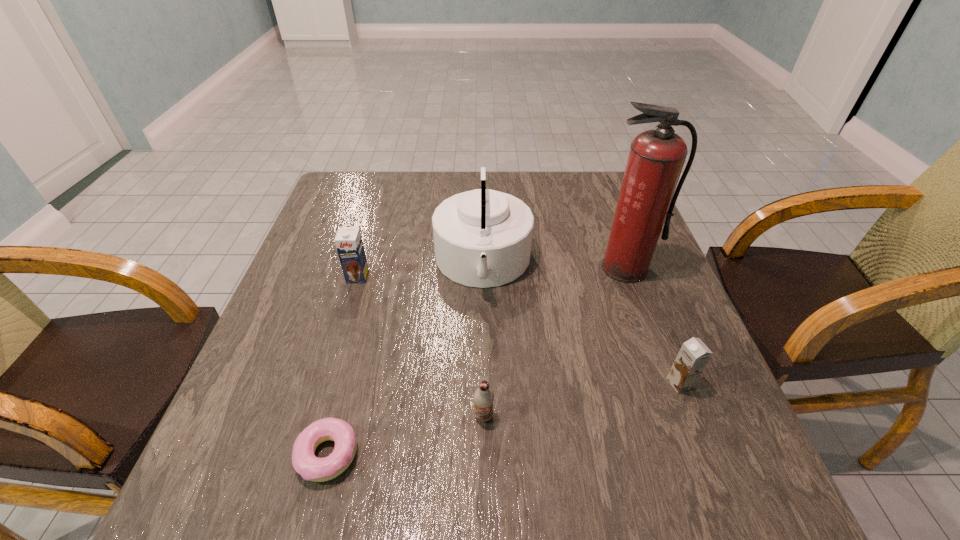
Locate an element on the screen. vacant space at the near right corner is located at coordinates (x=745, y=465).

Identify the location of free spot between the fifth tallest object and the fifth shortest object. The width and height of the screenshot is (960, 540). (483, 340).

This screenshot has height=540, width=960. What are the coordinates of `vacant space that is in between the doughnut and the fire extinguisher` in the screenshot? It's located at (476, 361).

Image resolution: width=960 pixels, height=540 pixels. What are the coordinates of `unoccupied position between the shortest chocolate milk and the doughnut` in the screenshot? It's located at (405, 435).

At what (x,y) coordinates should I click in order to perform the action: click on free area in between the fire extinguisher and the nearest object. Please return your answer as a coordinate pair (x, y). This screenshot has height=540, width=960. Looking at the image, I should click on (476, 361).

At what (x,y) coordinates should I click in order to perform the action: click on free space between the kettle and the nearest chocolate milk. Please return your answer as a coordinate pair (x, y). Looking at the image, I should click on (483, 340).

You are a GUI agent. You are given a task and a screenshot of the screen. Output one action in this format:
    pyautogui.click(x=<x>, y=<y>)
    Task: Click on the free space that is in between the second farthest chocolate milk and the farthest chocolate milk
    The height and width of the screenshot is (540, 960).
    Given the screenshot: What is the action you would take?
    pyautogui.click(x=518, y=330)

Where is `free space that is in between the fire extinguisher and the second tallest object`? The image size is (960, 540). free space that is in between the fire extinguisher and the second tallest object is located at coordinates (554, 266).

I want to click on unoccupied position between the fourth farthest object and the second shortest object, so click(582, 400).

You are a GUI agent. You are given a task and a screenshot of the screen. Output one action in this format:
    pyautogui.click(x=<x>, y=<y>)
    Task: Click on the vacant region between the second farthest chocolate milk and the leftmost chocolate milk
    The height and width of the screenshot is (540, 960).
    Given the screenshot: What is the action you would take?
    pyautogui.click(x=518, y=330)